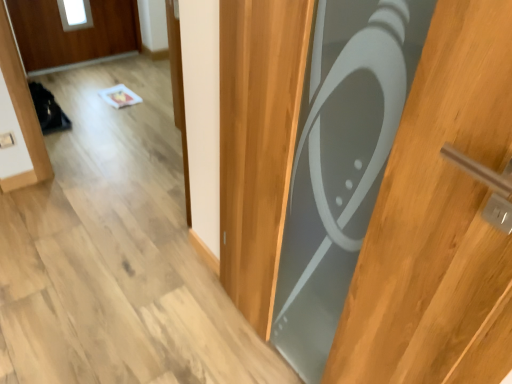
Question: Visually, is matte gray door at center positioned to the left or to the right of white plastic electric outlet at lower left?

Choices:
 (A) right
 (B) left

Answer: (A)

Question: From their relative heights in the image, would you say matte gray door at center is taller or shorter than white plastic electric outlet at lower left?

Choices:
 (A) tall
 (B) short

Answer: (A)

Question: From the image's perspective, is matte gray door at center located above or below white plastic electric outlet at lower left?

Choices:
 (A) above
 (B) below

Answer: (B)

Question: Is white plastic electric outlet at lower left taller or shorter than matte gray door at center?

Choices:
 (A) short
 (B) tall

Answer: (A)

Question: From a real-world perspective, is white plastic electric outlet at lower left above or below matte gray door at center?

Choices:
 (A) above
 (B) below

Answer: (B)

Question: From the image's perspective, relative to matte gray door at center, is white plastic electric outlet at lower left above or below?

Choices:
 (A) below
 (B) above

Answer: (B)

Question: In terms of width, does white plastic electric outlet at lower left look wider or thinner when compared to matte gray door at center?

Choices:
 (A) thin
 (B) wide

Answer: (A)